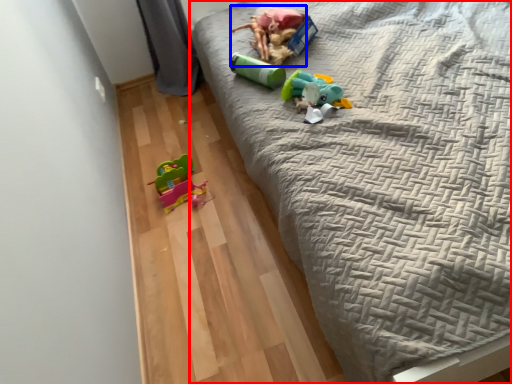
Question: Among these objects, which one is nearest to the camera, bed (highlighted by a red box) or toy (highlighted by a blue box)?

Choices:
 (A) bed
 (B) toy

Answer: (A)